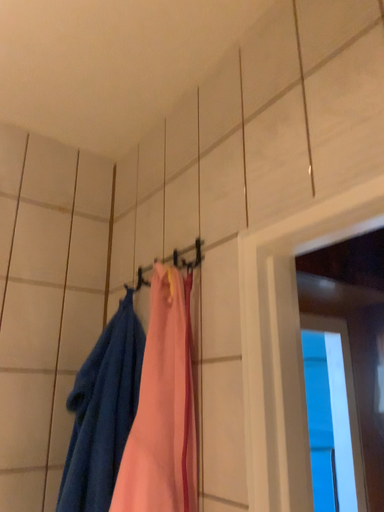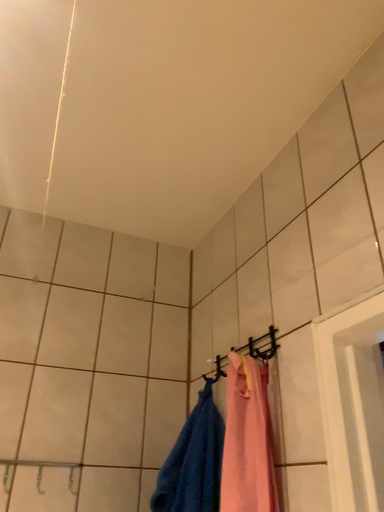
Question: Which way did the camera rotate in the video?

Choices:
 (A) rotated upward
 (B) rotated downward

Answer: (A)